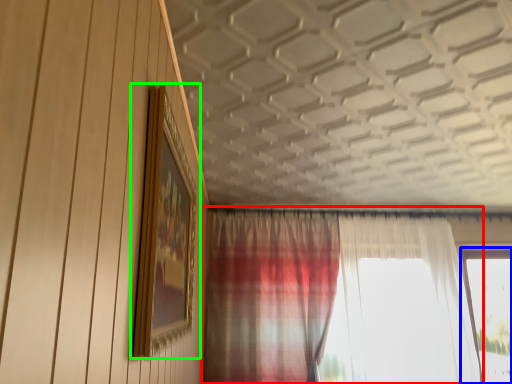
Question: Which object is positioned closest to curtain (highlighted by a red box)? Select from window (highlighted by a blue box) and picture frame (highlighted by a green box).

Choices:
 (A) window
 (B) picture frame

Answer: (A)